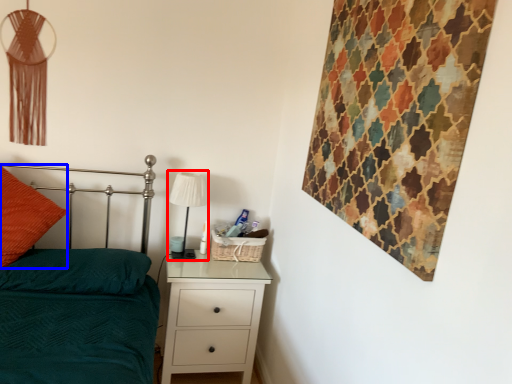
Question: Which of the following is the farthest to the observer, table lamp (highlighted by a red box) or throw pillow (highlighted by a blue box)?

Choices:
 (A) table lamp
 (B) throw pillow

Answer: (A)